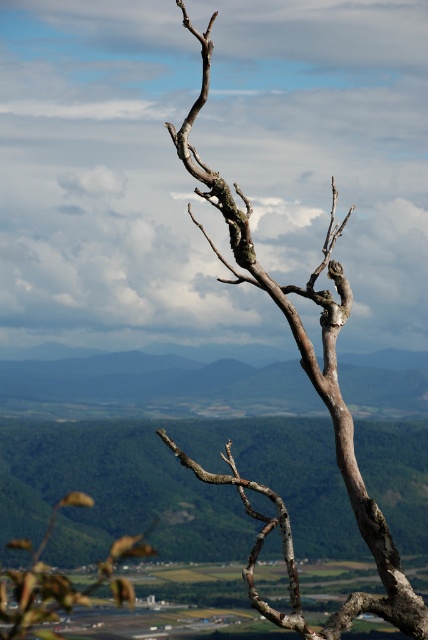
Question: Which point is farther to the camera?

Choices:
 (A) (253, 509)
 (B) (222, 362)
 (C) (335, 314)

Answer: (B)

Question: Which point appears closest to the camera in this image?

Choices:
 (A) (122, 378)
 (B) (261, 531)

Answer: (B)

Question: Is green grassy plain at center thinner than smooth brown branch at center?

Choices:
 (A) no
 (B) yes

Answer: (B)

Question: Is green grassy plain at center above barky brown branch at upper right?

Choices:
 (A) no
 (B) yes

Answer: (A)

Question: Can you confirm if barky brown branch at upper right is positioned below smooth brown branch at center?

Choices:
 (A) no
 (B) yes

Answer: (A)

Question: Which point is closer to the camera?

Choices:
 (A) (244, 481)
 (B) (377, 608)
 (C) (262, 380)

Answer: (B)